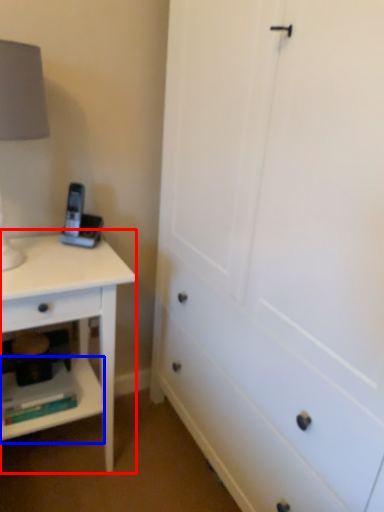
Question: Which object is further to the camera taking this photo, nightstand (highlighted by a red box) or shelf (highlighted by a blue box)?

Choices:
 (A) nightstand
 (B) shelf

Answer: (B)